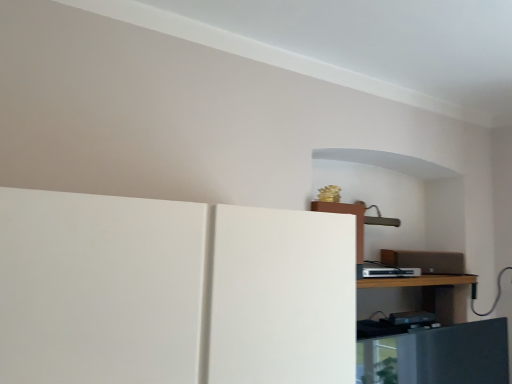
Question: Are silver metallic cable box at upper right and brown wooden shelf at center beside each other?

Choices:
 (A) yes
 (B) no

Answer: (B)

Question: Does silver metallic cable box at upper right have a larger size compared to brown wooden shelf at center?

Choices:
 (A) no
 (B) yes

Answer: (A)

Question: Can you confirm if silver metallic cable box at upper right is wider than brown wooden shelf at center?

Choices:
 (A) no
 (B) yes

Answer: (A)

Question: Is silver metallic cable box at upper right oriented away from brown wooden shelf at center?

Choices:
 (A) yes
 (B) no

Answer: (B)

Question: From the image's perspective, would you say silver metallic cable box at upper right is shown under brown wooden shelf at center?

Choices:
 (A) yes
 (B) no

Answer: (B)

Question: Is silver metallic cable box at upper right shorter than brown wooden shelf at center?

Choices:
 (A) yes
 (B) no

Answer: (B)

Question: Is there a large distance between brown wooden shelf at center and silver metallic cable box at upper right?

Choices:
 (A) no
 (B) yes

Answer: (A)

Question: Is brown wooden shelf at center oriented towards silver metallic cable box at upper right?

Choices:
 (A) no
 (B) yes

Answer: (A)

Question: Would you say brown wooden shelf at center contains silver metallic cable box at upper right?

Choices:
 (A) no
 (B) yes

Answer: (A)

Question: Is brown wooden shelf at center facing away from silver metallic cable box at upper right?

Choices:
 (A) yes
 (B) no

Answer: (B)

Question: From the image's perspective, is brown wooden shelf at center on silver metallic cable box at upper right?

Choices:
 (A) yes
 (B) no

Answer: (B)

Question: Considering the relative sizes of brown wooden shelf at center and silver metallic cable box at upper right in the image provided, is brown wooden shelf at center thinner than silver metallic cable box at upper right?

Choices:
 (A) no
 (B) yes

Answer: (A)

Question: Is brown wooden shelf at center situated inside silver metallic cable box at upper right or outside?

Choices:
 (A) outside
 (B) inside

Answer: (A)